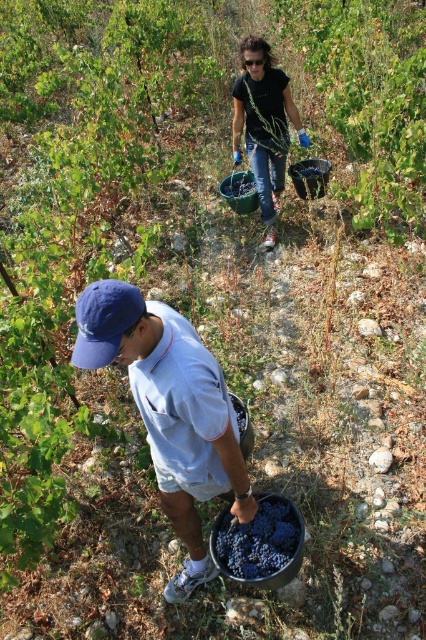
Question: Which point is closer to the camera?

Choices:
 (A) (252, 140)
 (B) (154, 413)

Answer: (B)

Question: Which object is farther from the camera taking this photo?

Choices:
 (A) blue fabric cap at lower left
 (B) dark purple grapes at lower center
 (C) black t-shirt at upper center

Answer: (C)

Question: Does blue fabric cap at lower left come in front of black t-shirt at upper center?

Choices:
 (A) yes
 (B) no

Answer: (A)

Question: Which object appears closest to the camera in this image?

Choices:
 (A) dark purple grapes at lower center
 (B) black t-shirt at upper center

Answer: (A)

Question: Does black t-shirt at upper center have a larger size compared to dark purple grapes at lower center?

Choices:
 (A) yes
 (B) no

Answer: (A)

Question: Does black t-shirt at upper center lie in front of dark purple grapes at lower center?

Choices:
 (A) yes
 (B) no

Answer: (B)